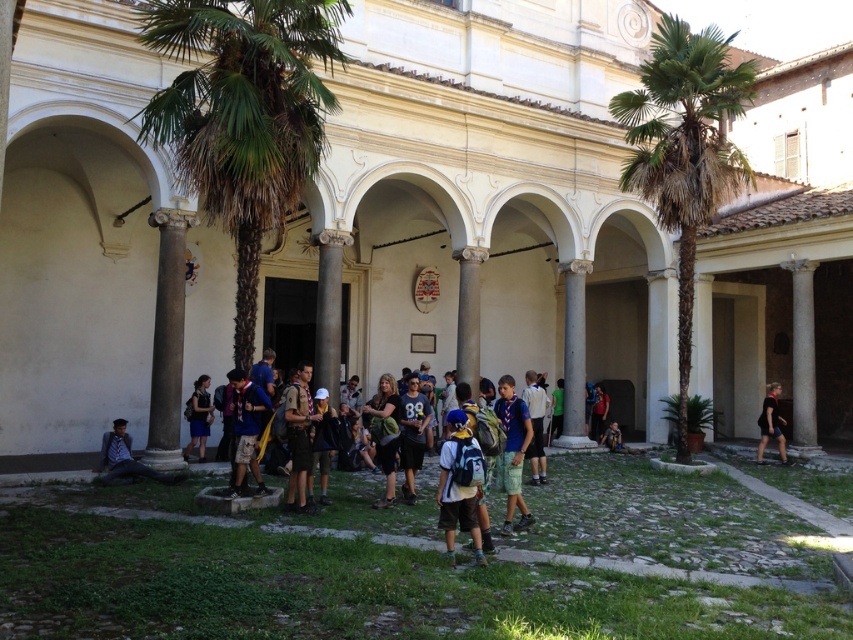
Question: Is white smooth building at center below green leafy palm tree at right?

Choices:
 (A) yes
 (B) no

Answer: (A)

Question: Which of the following is the closest to the observer?

Choices:
 (A) (648, 150)
 (B) (195, 384)

Answer: (B)

Question: Which point is closer to the camera?

Choices:
 (A) (479, 486)
 (B) (679, 348)
 (C) (544, 365)
 (D) (160, 323)

Answer: (A)

Question: Does dark blue uniform at center appear over black fabric shirt at right?

Choices:
 (A) yes
 (B) no

Answer: (A)

Question: Does white marble pillar at center appear over matte black backpack at center?

Choices:
 (A) no
 (B) yes

Answer: (B)

Question: Based on their relative distances, which object is nearer to the white smooth building at center?

Choices:
 (A) dark blue uniform at center
 (B) white marble pillar at center
 (C) green leafy palm tree at right
 (D) blue denim shorts at center

Answer: (C)